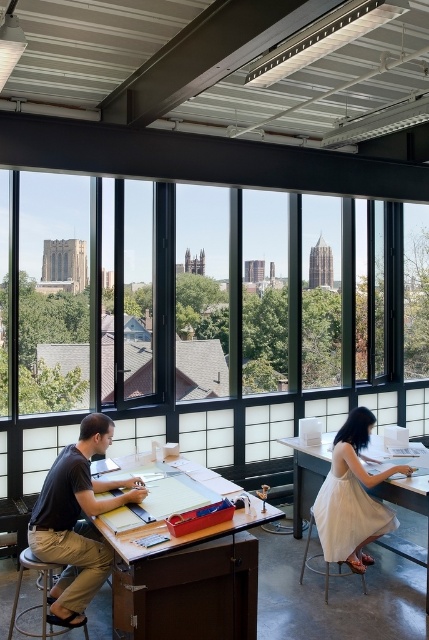
You are an office cleaner who needs to clean under the wooden drafting table at center and the white cotton dress at center. Which object should you clean first if you want to start with the taller one?

The white cotton dress at center is taller than the wooden drafting table at center, so you should clean the white cotton dress at center first.

You are an office worker who needs to choose a stool for a presentation. The dark brown leather stool at lower left is more comfortable for longer periods, but the white fabric stool at lower right is easier to move. Which stool would you choose if you need to move it frequently?

The white fabric stool at lower right is easier to move, so you should choose the white fabric stool at lower right for frequent movement.